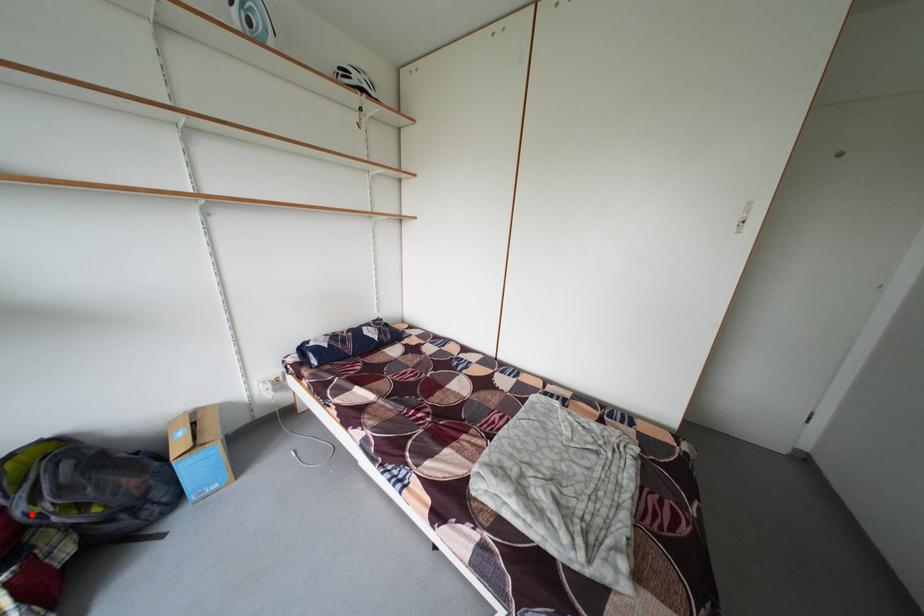
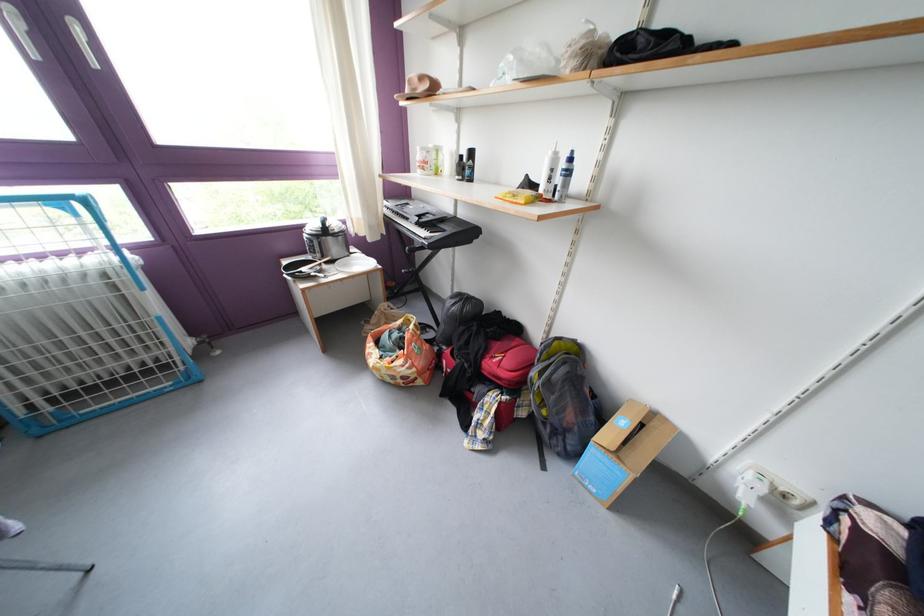
Question: I am providing you with two images of the same scene from different viewpoints. In image1, a red point is highlighted. Considering the same 3D point in image2, which of the following is correct?

Choices:
 (A) It is closer
 (B) It is farther

Answer: (B)